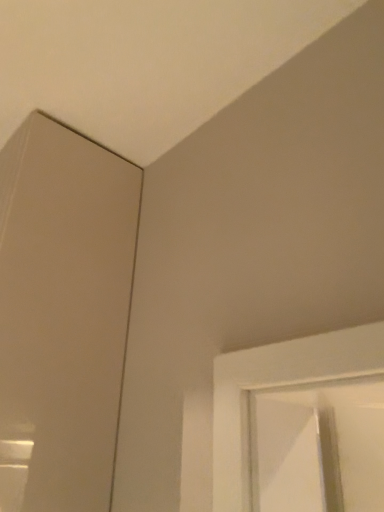
The image size is (384, 512). What do you see at coordinates (62, 314) in the screenshot?
I see `matte beige cabinet at left` at bounding box center [62, 314].

The image size is (384, 512). Identify the location of matte beige cabinet at left. (62, 314).

At what (x,y) coordinates should I click in order to perform the action: click on matte beige cabinet at left. Please return your answer as a coordinate pair (x, y). This screenshot has height=512, width=384. Looking at the image, I should click on (62, 314).